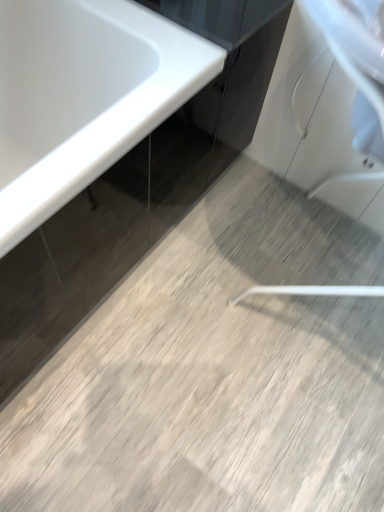
Question: In the image, is glossy black cabinet at upper center positioned in front of or behind white glossy bathtub at upper left?

Choices:
 (A) behind
 (B) front

Answer: (A)

Question: From the image's perspective, relative to white glossy bathtub at upper left, is glossy black cabinet at upper center above or below?

Choices:
 (A) below
 (B) above

Answer: (B)

Question: Based on their positions, is glossy black cabinet at upper center located to the left or right of white glossy bathtub at upper left?

Choices:
 (A) right
 (B) left

Answer: (A)

Question: Looking at the image, does white glossy bathtub at upper left seem bigger or smaller compared to glossy black cabinet at upper center?

Choices:
 (A) small
 (B) big

Answer: (B)

Question: From the image's perspective, is white glossy bathtub at upper left located above or below glossy black cabinet at upper center?

Choices:
 (A) below
 (B) above

Answer: (A)

Question: Is white glossy bathtub at upper left taller or shorter than glossy black cabinet at upper center?

Choices:
 (A) tall
 (B) short

Answer: (A)

Question: From a real-world perspective, is white glossy bathtub at upper left physically located above or below glossy black cabinet at upper center?

Choices:
 (A) below
 (B) above

Answer: (A)